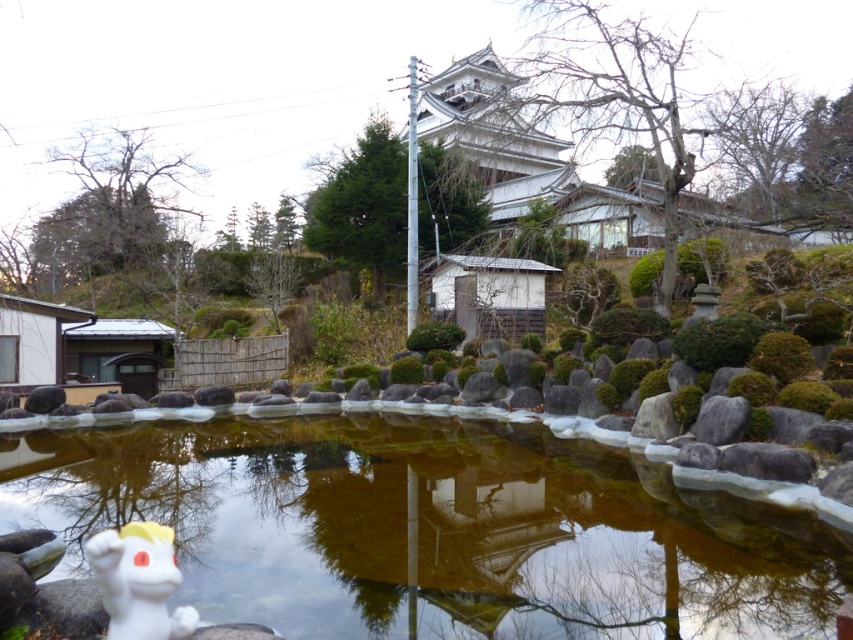
You are a visitor at this Japanese garden and want to take a photo of the white matte dragon at lower left. However, you notice that the clear glass water at center might block your view. Can you still see the dragon clearly through the water?

The clear glass water at center is larger in size than white matte dragon at lower left, so the dragon may be partially obscured by the water depending on the angle and clarity. However, since the water is described as clear glass, it might still allow visibility of the dragon if positioned correctly.

You are standing at the edge of the pond and want to see the reflection of the white matte dragon at lower left in the clear glass water at center. Is the dragon reflected in the water?

The clear glass water at center is to the right of the white matte dragon at lower left, so the dragon is positioned to the left of the water. Since reflections in water typically mirror the objects above them, the dragon should be reflected in the water as long as it is within the water surface area. However, the dragon is at the edge of the pond, so its reflection might be partially visible depending on the water surface extent.